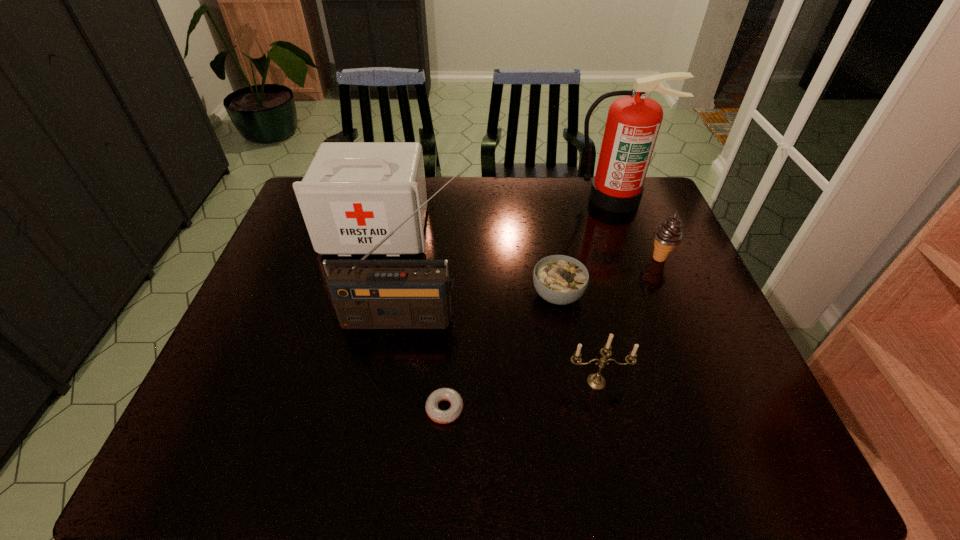
The height and width of the screenshot is (540, 960). Identify the location of blank space that satisfies the following two spatial constraints: 1. on the front-facing side of the icecream; 2. on the left side of the first-aid kit. point(370,258).

This screenshot has height=540, width=960. Identify the location of vacant position in the image that satisfies the following two spatial constraints: 1. on the back side of the icecream; 2. on the right side of the shortest object. (454, 258).

Image resolution: width=960 pixels, height=540 pixels. What are the coordinates of `vacant area that satisfies the following two spatial constraints: 1. at the nozzle of the icecream; 2. on the left side of the fire extinguisher` in the screenshot? It's located at (637, 258).

The image size is (960, 540). In order to click on vacant space that satisfies the following two spatial constraints: 1. on the front-facing side of the icecream; 2. on the left side of the first-aid kit in this screenshot , I will do `click(370, 258)`.

Where is `blank area in the image that satisfies the following two spatial constraints: 1. on the front-facing side of the shortest object; 2. on the left side of the radio receiver`? Image resolution: width=960 pixels, height=540 pixels. blank area in the image that satisfies the following two spatial constraints: 1. on the front-facing side of the shortest object; 2. on the left side of the radio receiver is located at coordinates (388, 409).